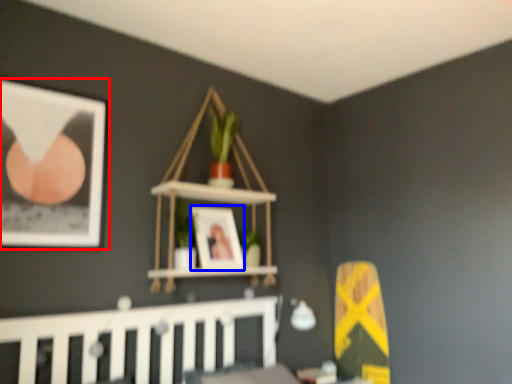
Question: Among these objects, which one is nearest to the camera, picture frame (highlighted by a red box) or picture frame (highlighted by a blue box)?

Choices:
 (A) picture frame
 (B) picture frame

Answer: (A)